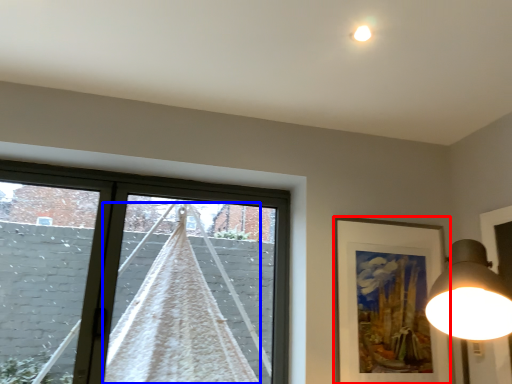
Question: Which point is further to the camera, picture frame (highlighted by a red box) or curtain (highlighted by a blue box)?

Choices:
 (A) picture frame
 (B) curtain

Answer: (A)